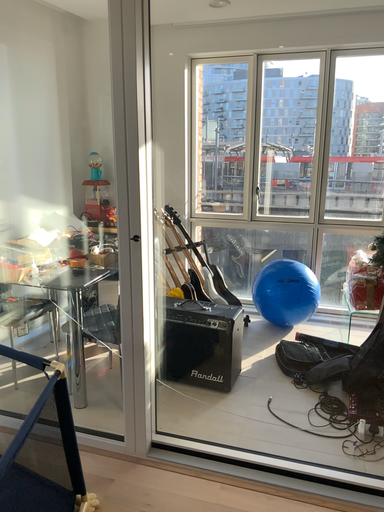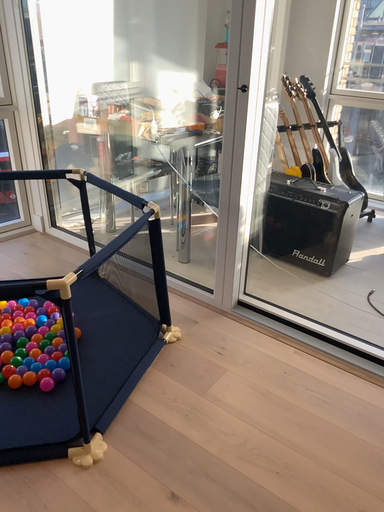
Question: Which way did the camera rotate in the video?

Choices:
 (A) rotated downward
 (B) rotated upward

Answer: (A)